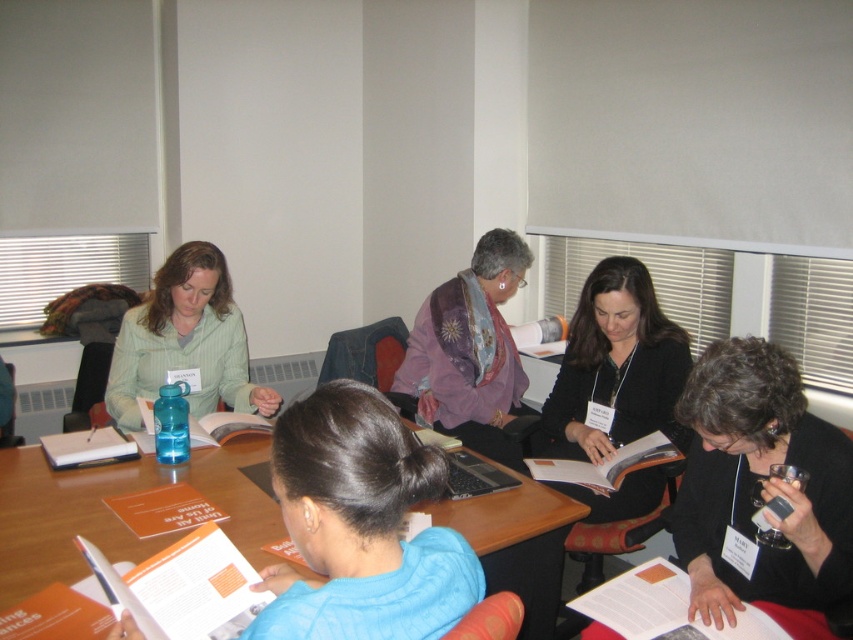
You are a participant in the meeting and need to place a folder on the wooden table at center. Where should you place it so it doesn not block the view of the black matte jacket at center?

Since the wooden table at center is located below the black matte jacket at center, placing the folder on the table would naturally be below the jacket, so it won not block the jacket s view.